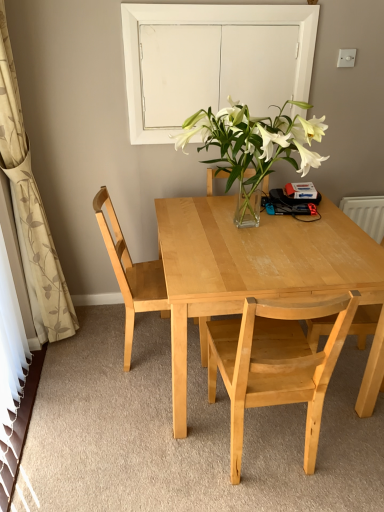
Find the location of a particular element. vacant space to the right of beige floral fabric curtain at left is located at coordinates (104, 350).